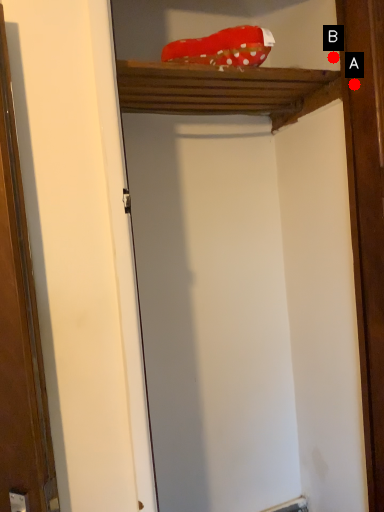
Question: Two points are circled on the image, labeled by A and B beside each circle. Which point is closer to the camera?

Choices:
 (A) A is closer
 (B) B is closer

Answer: (A)